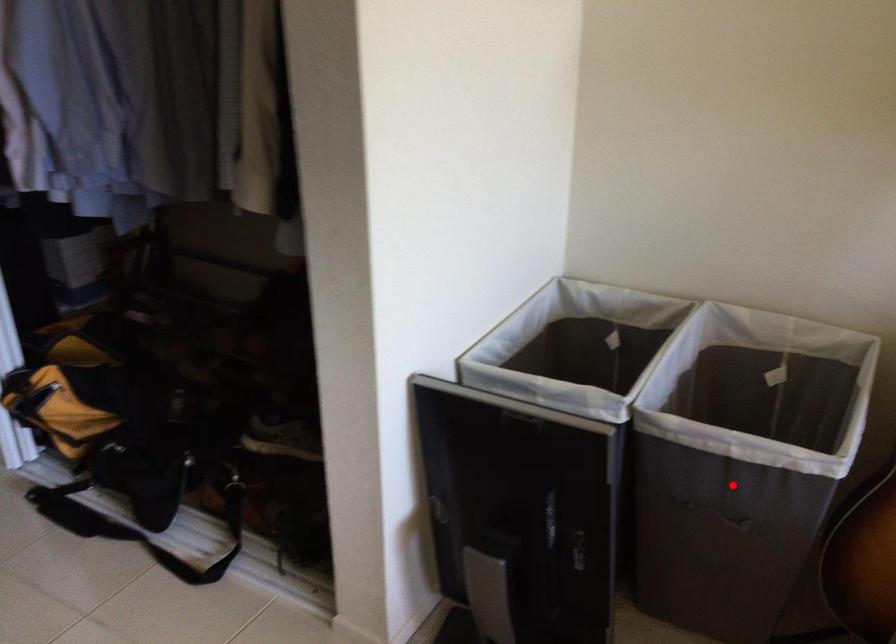
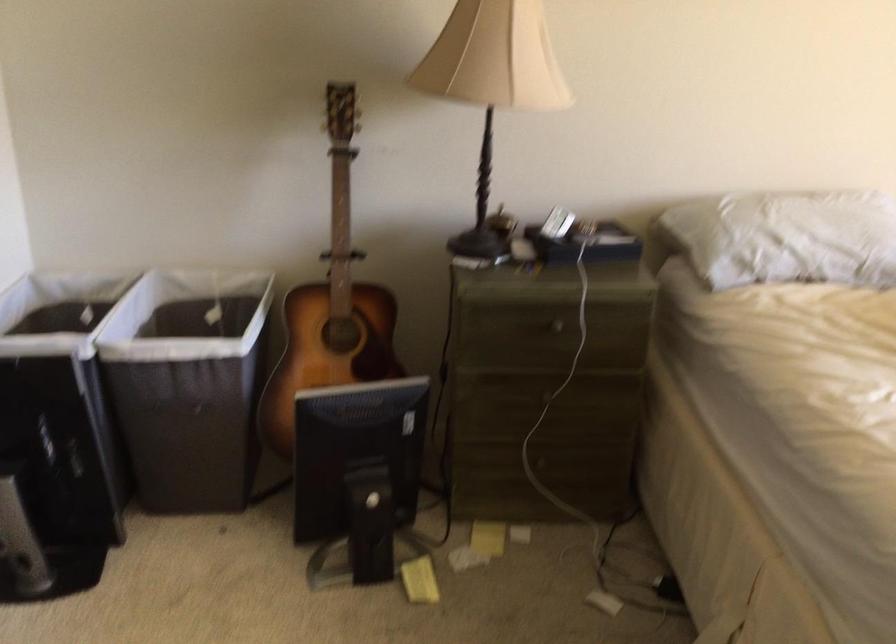
Question: I am providing you with two images of the same scene from different viewpoints. Image1 has a red point marked. In image2, the corresponding 3D location appears at what relative position? Reply with the corresponding letter.

Choices:
 (A) Closer
 (B) Farther

Answer: (B)